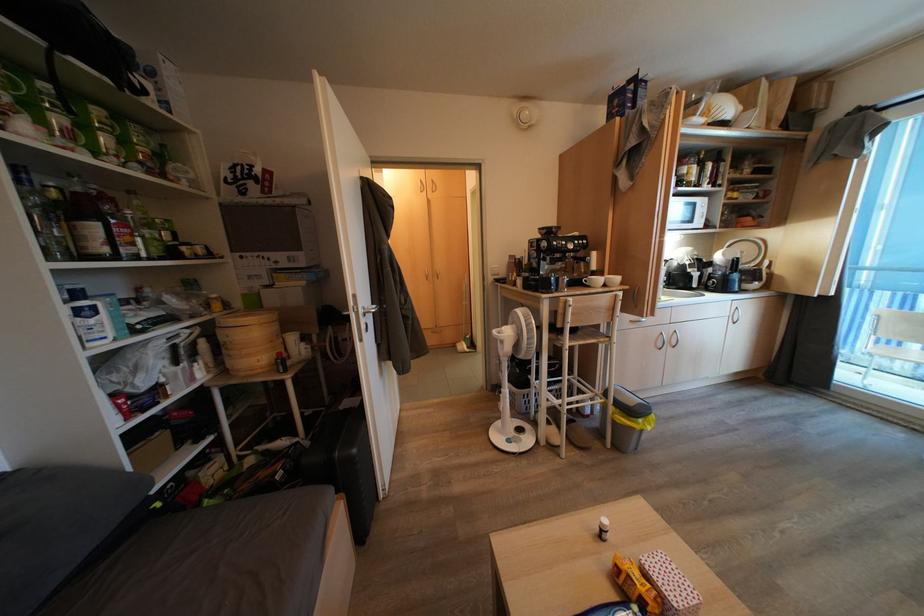
Identify the location of sofa sitting surface. The height and width of the screenshot is (616, 924). (212, 562).